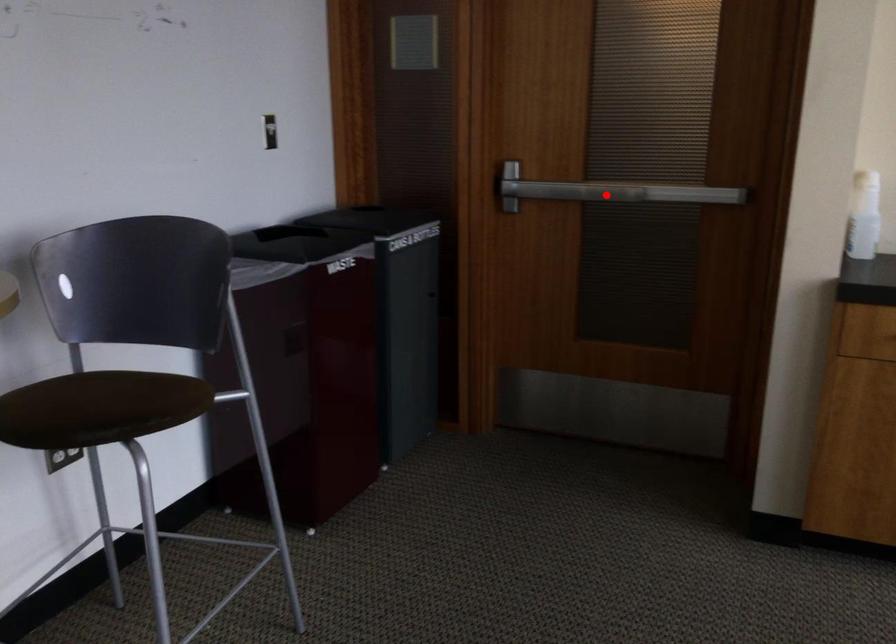
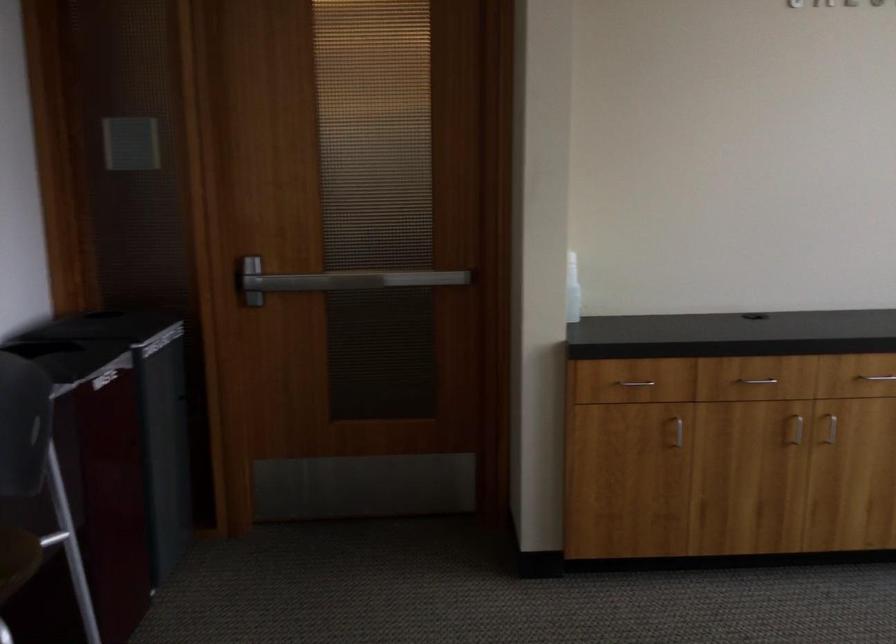
Find the pixel in the second image that matches the highlighted location in the first image.

(354, 279)